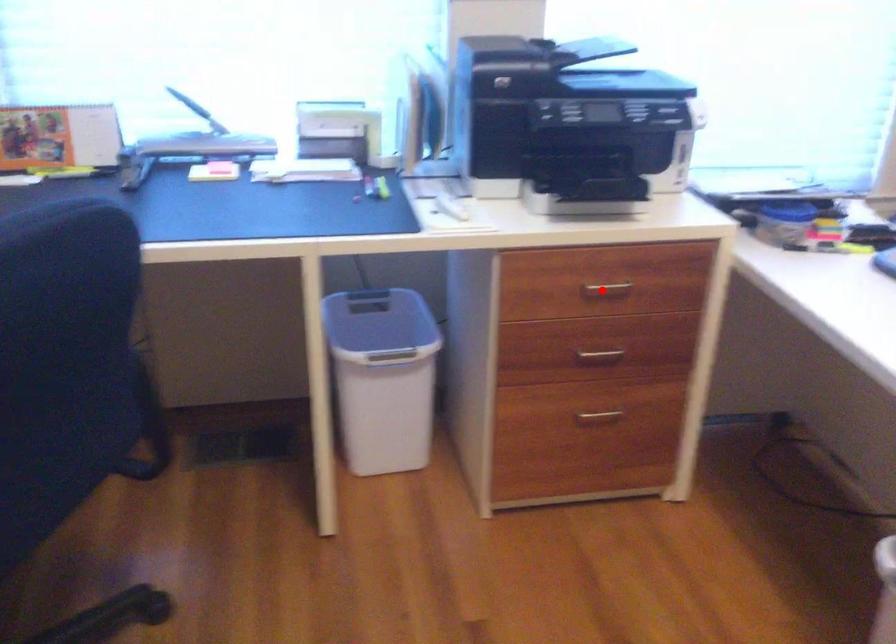
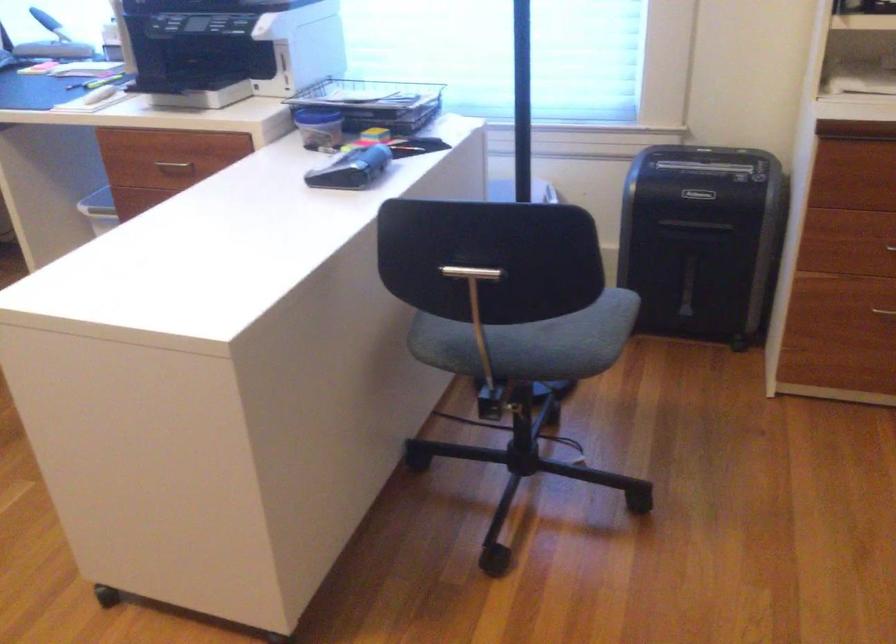
Question: A red point is marked in image1. In image2, is the corresponding 3D point closer to the camera or farther? Reply with the corresponding letter.

Choices:
 (A) The corresponding 3D point is closer.
 (B) The corresponding 3D point is farther.

Answer: (B)